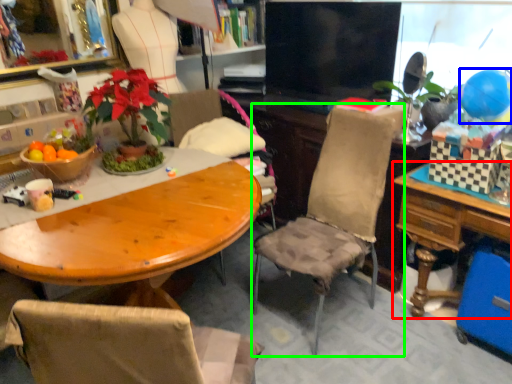
Question: Estimate the real-world distances between objects in this image. Which object is farther from table (highlighted by a red box), balloon (highlighted by a blue box) or chair (highlighted by a green box)?

Choices:
 (A) balloon
 (B) chair

Answer: (A)